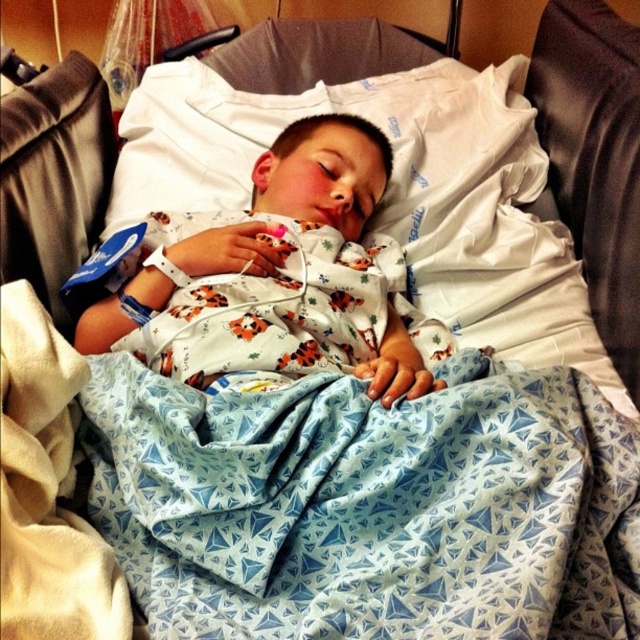
You are a nurse checking on a patient in a hospital room. You see the blue printed fabric at center and the white cotton pajamas at center. Which one is positioned to the right side of the other?

The blue printed fabric at center is to the right of the white cotton pajamas at center.

In the scene shown: You are a nurse checking on a child in a hospital room. You notice the blue printed fabric at center and the white cotton pajamas at center. Which item is shorter in height?

The blue printed fabric at center has a lesser height compared to the white cotton pajamas at center, so the blue printed fabric at center is shorter in height.

You are a nurse standing at the bedside of a child in a hospital. You need to place a medical device on the point at coordinate point [273,404]. The device requires a minimum of 30 inches of space to function properly. Is the current distance sufficient?

The distance between the viewer and point [273,404] is 29.22 inches, which is less than the required 30 inches. Therefore, the current distance is insufficient for the device to function properly.